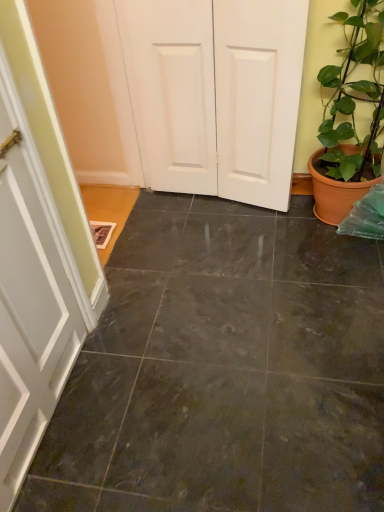
Question: Is white matte door at center thinner than dark gray tile floor at center?

Choices:
 (A) yes
 (B) no

Answer: (A)

Question: From a real-world perspective, is white matte door at center positioned under dark gray tile floor at center based on gravity?

Choices:
 (A) yes
 (B) no

Answer: (B)

Question: Is white matte door at center further to camera compared to dark gray tile floor at center?

Choices:
 (A) yes
 (B) no

Answer: (A)

Question: From a real-world perspective, is white matte door at center over dark gray tile floor at center?

Choices:
 (A) yes
 (B) no

Answer: (A)

Question: Does white matte door at center have a larger size compared to dark gray tile floor at center?

Choices:
 (A) no
 (B) yes

Answer: (B)

Question: Is green glossy plant at right inside or outside of dark gray tile floor at center?

Choices:
 (A) inside
 (B) outside

Answer: (B)

Question: From a real-world perspective, is green glossy plant at right physically located above or below dark gray tile floor at center?

Choices:
 (A) below
 (B) above

Answer: (B)

Question: In terms of height, does green glossy plant at right look taller or shorter compared to dark gray tile floor at center?

Choices:
 (A) short
 (B) tall

Answer: (B)

Question: Based on their sizes in the image, would you say green glossy plant at right is bigger or smaller than dark gray tile floor at center?

Choices:
 (A) big
 (B) small

Answer: (A)

Question: Considering the positions of point (152, 27) and point (64, 389), is point (152, 27) closer or farther from the camera than point (64, 389)?

Choices:
 (A) farther
 (B) closer

Answer: (A)

Question: Considering their positions, is white matte door at center located in front of or behind dark gray tile floor at center?

Choices:
 (A) behind
 (B) front

Answer: (A)

Question: In the image, is white matte door at center on the left side or the right side of dark gray tile floor at center?

Choices:
 (A) left
 (B) right

Answer: (A)

Question: Considering the positions of white matte door at center and dark gray tile floor at center in the image, is white matte door at center taller or shorter than dark gray tile floor at center?

Choices:
 (A) short
 (B) tall

Answer: (B)

Question: Looking at the image, does dark gray tile floor at center seem bigger or smaller compared to green glossy plant at right?

Choices:
 (A) small
 (B) big

Answer: (A)

Question: From a real-world perspective, is dark gray tile floor at center above or below green glossy plant at right?

Choices:
 (A) below
 (B) above

Answer: (A)